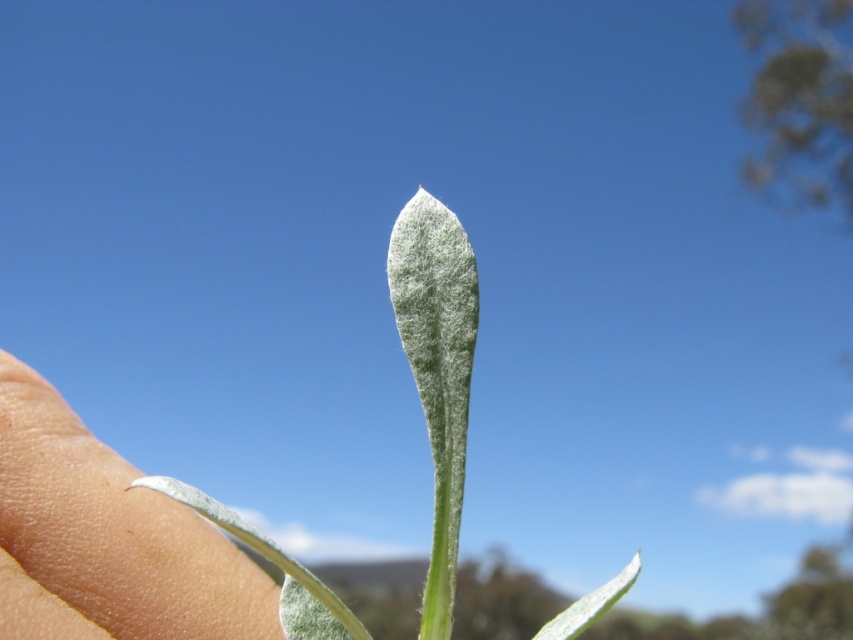
Can you confirm if white fuzzy leaf at lower left is thinner than white fuzzy leaf at center?

Indeed, white fuzzy leaf at lower left has a lesser width compared to white fuzzy leaf at center.

Which is in front, point (22, 609) or point (428, 608)?

Positioned in front is point (22, 609).

Where is `white fuzzy leaf at lower left`? Image resolution: width=853 pixels, height=640 pixels. white fuzzy leaf at lower left is located at coordinates 105,538.